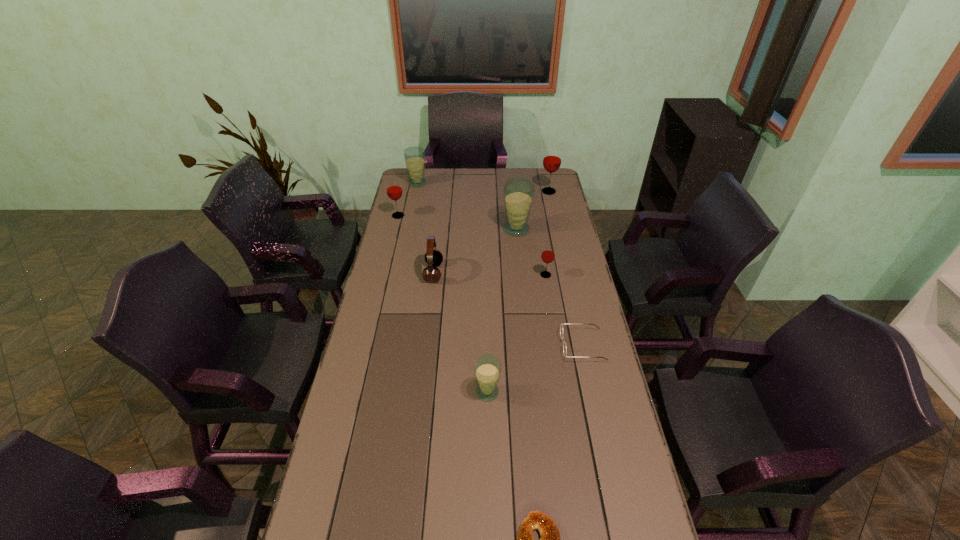
You are a GUI agent. You are given a task and a screenshot of the screen. Output one action in this format:
    pyautogui.click(x=<x>, y=<y>)
    Task: Click on the smallest red glass
    This screenshot has height=540, width=960.
    Given the screenshot: What is the action you would take?
    pyautogui.click(x=548, y=253)

At what (x,y) coordinates should I click in order to perform the action: click on the nearest red glass. Please return your answer as a coordinate pair (x, y). This screenshot has width=960, height=540. Looking at the image, I should click on pyautogui.click(x=548, y=253).

Locate an element on the screen. The height and width of the screenshot is (540, 960). the nearest glass is located at coordinates coord(487,368).

Identify the location of the third glass from left to right. (487, 368).

In order to click on the second shortest object in this screenshot , I will do `click(561, 326)`.

Locate an element on the screen. The image size is (960, 540). the third nearest object is located at coordinates (561, 326).

Locate an element on the screen. vacant space positioned on the left of the rightmost red glass is located at coordinates (522, 192).

This screenshot has height=540, width=960. Identify the location of vacant region located on the right of the fourth farthest object. (564, 230).

What are the coordinates of `free spot located on the front of the farthest blue glass` in the screenshot? It's located at (414, 199).

I want to click on vacant space located 0.170m on the right of the second biggest red glass, so click(x=443, y=216).